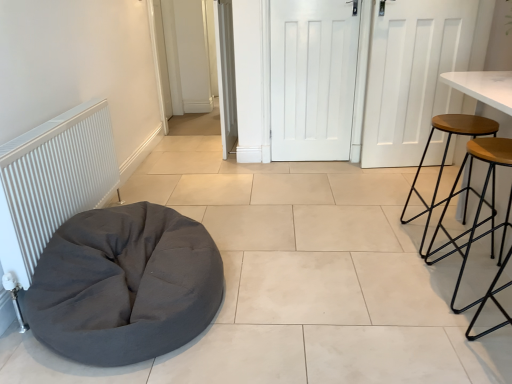
Identify the location of free location to the right of white ribbed radiator at left. (258, 256).